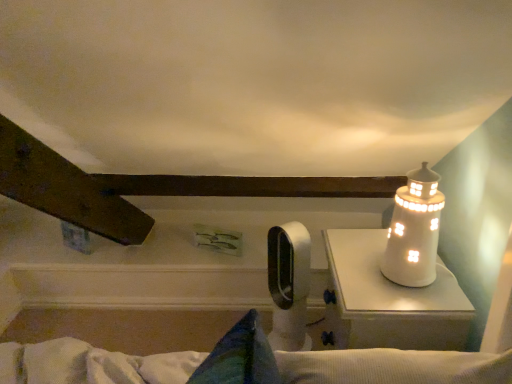
I want to click on vacant space situated on the left part of white ceramic lighthouse at upper right, so click(x=356, y=280).